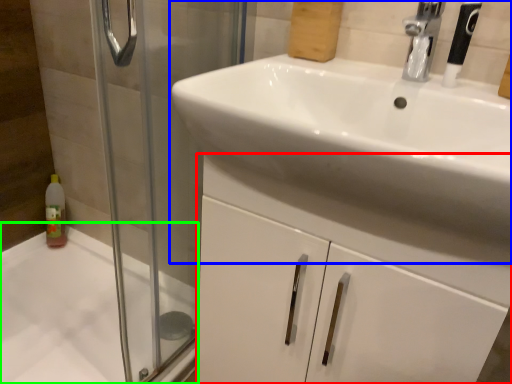
Question: Based on their relative distances, which object is nearer to bathroom cabinet (highlighted by a red box)? Choose from sink (highlighted by a blue box) and bath (highlighted by a green box).

Choices:
 (A) sink
 (B) bath

Answer: (A)